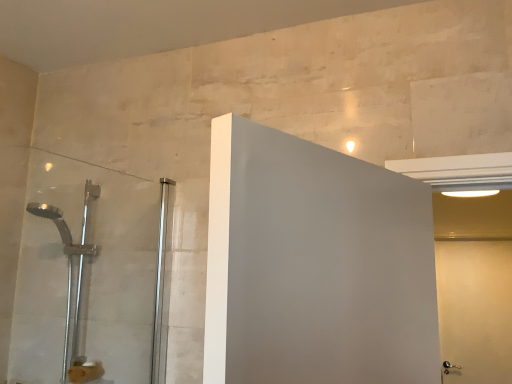
Question: Is point (53, 309) positioned closer to the camera than point (439, 306)?

Choices:
 (A) closer
 (B) farther

Answer: (A)

Question: From a real-world perspective, is satin chrome shower door at left physically located above or below white matte door at right?

Choices:
 (A) below
 (B) above

Answer: (B)

Question: Is satin chrome shower door at left inside or outside of white matte door at right?

Choices:
 (A) outside
 (B) inside

Answer: (A)

Question: From the image's perspective, is white matte door at right positioned above or below satin chrome shower door at left?

Choices:
 (A) below
 (B) above

Answer: (A)

Question: Is point (483, 375) closer or farther from the camera than point (124, 329)?

Choices:
 (A) farther
 (B) closer

Answer: (A)

Question: Is white matte door at right in front of or behind satin chrome shower door at left in the image?

Choices:
 (A) front
 (B) behind

Answer: (B)

Question: In terms of size, does white matte door at right appear bigger or smaller than satin chrome shower door at left?

Choices:
 (A) big
 (B) small

Answer: (B)